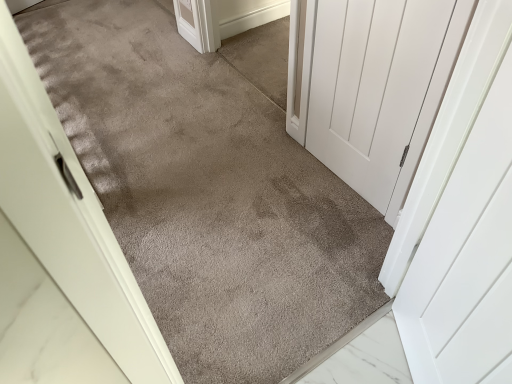
You are a GUI agent. You are given a task and a screenshot of the screen. Output one action in this format:
    pyautogui.click(x=<x>, y=<y>)
    Task: Click on the unoccupied area in front of white matte door at center
    This screenshot has width=512, height=384.
    Given the screenshot: What is the action you would take?
    pyautogui.click(x=337, y=228)